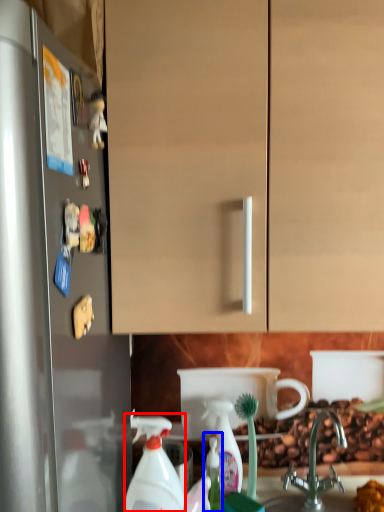
Question: Among these objects, which one is farthest to the camera, cleaning product (highlighted by a red box) or bottle (highlighted by a blue box)?

Choices:
 (A) cleaning product
 (B) bottle

Answer: (B)